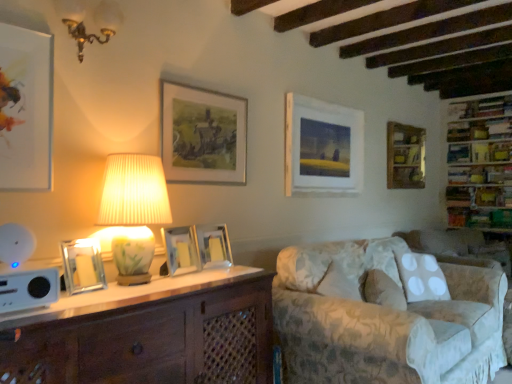
Question: Based on their sizes in the image, would you say wooden bookshelf at upper right, the first shelf when ordered from top to bottom, is bigger or smaller than matte white picture frame at upper left, which is the 7th picture frame in right-to-left order?

Choices:
 (A) small
 (B) big

Answer: (B)

Question: From the image's perspective, is wooden bookshelf at upper right, the first shelf when ordered from top to bottom, above or below matte white picture frame at upper left, which is the 1th picture frame from front to back?

Choices:
 (A) below
 (B) above

Answer: (B)

Question: Which of these objects is positioned closest to the fluffy white pillow at lower right?

Choices:
 (A) silver metallic picture frame at center, which is the 5th picture frame from left to right
 (B) gold metallic chandelier at upper left, which is the first lamp from top to bottom
 (C) wooden bookshelf at upper right, the first shelf when ordered from top to bottom
 (D) matte glass picture frame at center, the 3th picture frame viewed from the left
 (E) transparent glass picture frame at left, positioned as the 6th picture frame in right-to-left order

Answer: (A)

Question: Considering the real-world distances, which object is closest to the white matte picture frame at center, the 6th picture frame from the left?

Choices:
 (A) matte white picture frame at upper left, which is counted as the seventh picture frame, starting from the back
 (B) wooden bookshelf at right, placed as the 1th shelf when sorted from bottom to top
 (C) gold-framed painting at upper center, which ranks as the 4th picture frame in right-to-left order
 (D) white plastic speaker at lower left
 (E) silver metallic picture frame at center, which is the 5th picture frame from left to right

Answer: (C)